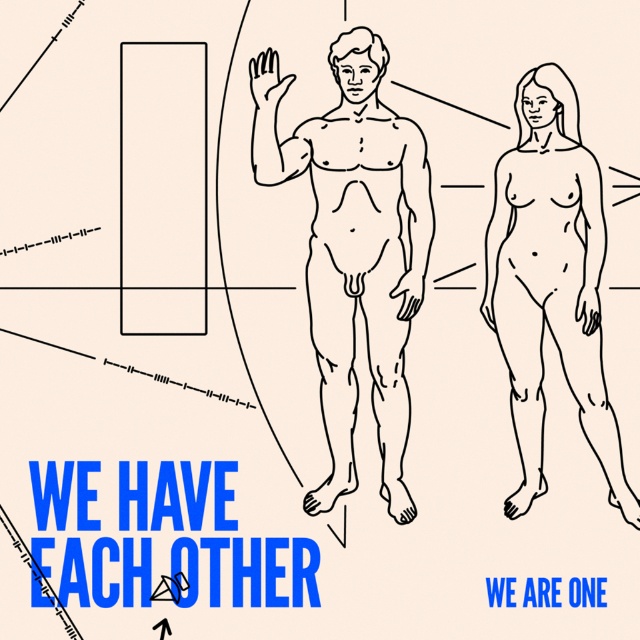
Question: Which object is farther from the camera taking this photo?

Choices:
 (A) black line drawing of man at center
 (B) smooth skin figure at right

Answer: (B)

Question: Which object is closer to the camera taking this photo?

Choices:
 (A) smooth skin figure at right
 (B) black line drawing of man at center

Answer: (B)

Question: Is the position of black line drawing of man at center less distant than that of smooth skin figure at right?

Choices:
 (A) no
 (B) yes

Answer: (B)

Question: Can you confirm if black line drawing of man at center is positioned to the left of smooth skin figure at right?

Choices:
 (A) no
 (B) yes

Answer: (B)

Question: Is black line drawing of man at center to the left of smooth skin figure at right from the viewer's perspective?

Choices:
 (A) yes
 (B) no

Answer: (A)

Question: Among these objects, which one is farthest from the camera?

Choices:
 (A) black line drawing of man at center
 (B) smooth skin figure at right

Answer: (B)